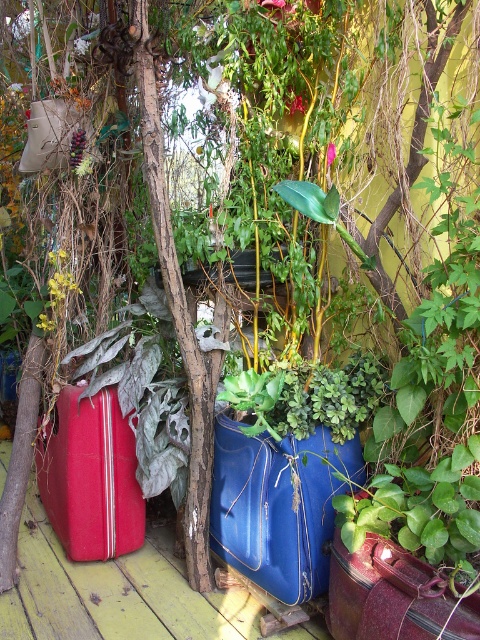
Question: Which of the following is the closest to the observer?

Choices:
 (A) matte red suitcase at lower left
 (B) glossy blue suitcase at center
 (C) rusty metallic suitcase at center
 (D) matte red suitcase at left

Answer: (C)

Question: Considering the relative positions of matte red suitcase at left and rusty metallic suitcase at center in the image provided, where is matte red suitcase at left located with respect to rusty metallic suitcase at center?

Choices:
 (A) left
 (B) right

Answer: (A)

Question: Which point is closer to the camera?

Choices:
 (A) (64, 396)
 (B) (339, 456)
 (C) (156, 628)

Answer: (C)

Question: Can you confirm if matte red suitcase at left is thinner than rusty metallic suitcase at center?

Choices:
 (A) yes
 (B) no

Answer: (B)

Question: Where is matte red suitcase at lower left located in relation to glossy blue suitcase at center in the image?

Choices:
 (A) left
 (B) right

Answer: (A)

Question: Based on their relative distances, which object is farther from the matte red suitcase at lower left?

Choices:
 (A) glossy blue suitcase at center
 (B) rusty metallic suitcase at center
 (C) matte red suitcase at left

Answer: (B)